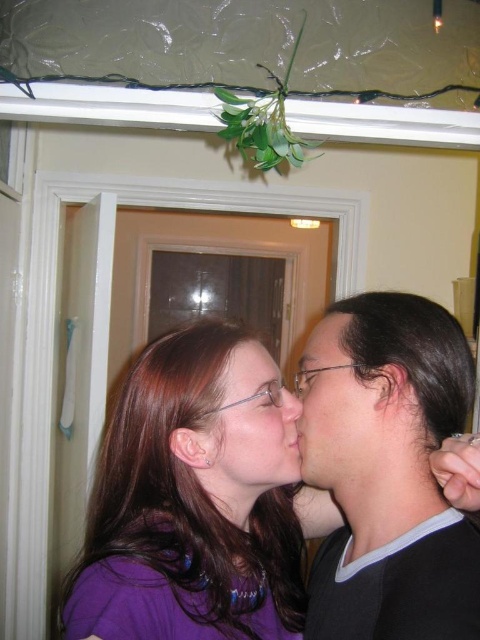
You are standing in the room and want to locate the black matte hair at right. What is the coordinate point where you can find it?

The black matte hair at right is located at coordinate point (394, 476).

You are an interior designer assessing the layout of this room. You notice the purple matte shirt at center and the black matte hair at right. Which object is positioned closer to the entrance of the room?

The black matte hair at right is behind the purple matte shirt at center, meaning the purple matte shirt at center is closer to the entrance of the room.